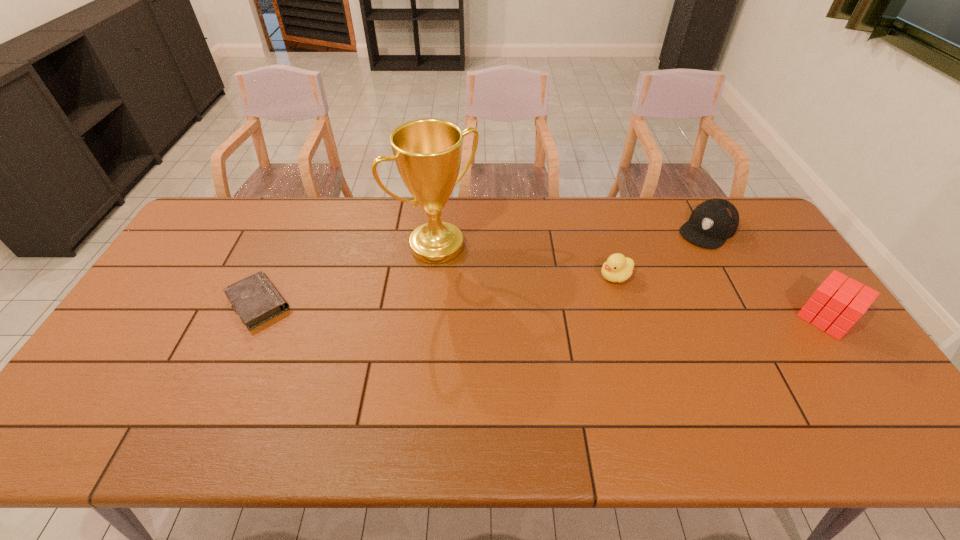
Image resolution: width=960 pixels, height=540 pixels. Find the location of `empty space between the rightmost object and the fourth object from left to right`. empty space between the rightmost object and the fourth object from left to right is located at coordinates (766, 274).

This screenshot has height=540, width=960. Identify the location of blank region between the third object from right to left and the shortest object. (437, 290).

Locate an element on the screen. free space between the cap and the duckling is located at coordinates (661, 253).

You are a GUI agent. You are given a task and a screenshot of the screen. Output one action in this format:
    pyautogui.click(x=<x>, y=<y>)
    Task: Click on the blank region between the cube and the shortest object
    This screenshot has width=960, height=540.
    Given the screenshot: What is the action you would take?
    (541, 310)

At what (x,y) coordinates should I click in order to perform the action: click on unoccupied position between the cap and the leftmost object. Please return your answer as a coordinate pair (x, y). The width and height of the screenshot is (960, 540). Looking at the image, I should click on (483, 266).

The width and height of the screenshot is (960, 540). In order to click on unoccupied position between the third object from left to right and the cap in this screenshot , I will do `click(661, 253)`.

Find the location of `free space between the tallest object and the duckling`. free space between the tallest object and the duckling is located at coordinates (526, 261).

Identify the location of free space between the rightmost object and the duckling. The image size is (960, 540). (721, 297).

Identify which object is the fourth closest to the cube. Please provide its 2D coordinates. Your answer should be formatted as a tuple, i.e. [(x, y)], where the tuple contains the x and y coordinates of a point satisfying the conditions above.

[(255, 299)]

At what (x,y) coordinates should I click in order to perform the action: click on the closest object to the cap. Please return your answer as a coordinate pair (x, y). Image resolution: width=960 pixels, height=540 pixels. Looking at the image, I should click on (842, 306).